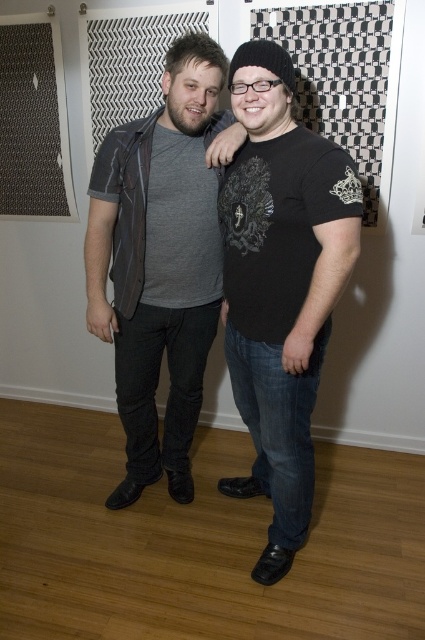
This screenshot has height=640, width=425. What do you see at coordinates (280, 285) in the screenshot?
I see `black matte t-shirt at center` at bounding box center [280, 285].

Consider the image. Can you confirm if black matte t-shirt at center is positioned to the right of matte gray shirt at center?

Correct, you'll find black matte t-shirt at center to the right of matte gray shirt at center.

Is point (308, 284) positioned in front of point (195, 157)?

Yes, it is in front of point (195, 157).

Where is `black matte t-shirt at center`? black matte t-shirt at center is located at coordinates (280, 285).